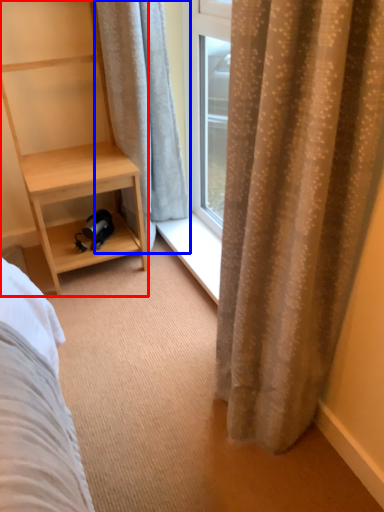
Question: Which of the following is the closest to the observer, shelf (highlighted by a red box) or curtain (highlighted by a blue box)?

Choices:
 (A) shelf
 (B) curtain

Answer: (A)